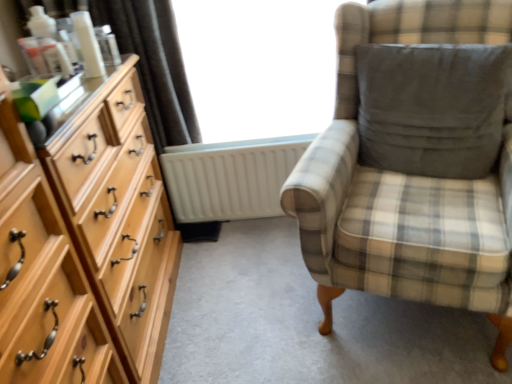
This screenshot has width=512, height=384. What do you see at coordinates (433, 108) in the screenshot?
I see `dark gray fabric pillow at right` at bounding box center [433, 108].

Identify the location of dark gray fabric pillow at right. (433, 108).

What are the coordinates of `plaid fabric chair at right` in the screenshot? It's located at (415, 161).

Describe the element at coordinates (259, 65) in the screenshot. I see `transparent glass window at center` at that location.

Identify the location of dark gray fabric pillow at right. This screenshot has width=512, height=384. (433, 108).

How different are the orientations of plaid fabric chair at right and transparent glass window at center in degrees?

They differ by 21.8 degrees in their facing directions.

Considering the relative sizes of plaid fabric chair at right and transparent glass window at center in the image provided, is plaid fabric chair at right bigger than transparent glass window at center?

Indeed, plaid fabric chair at right has a larger size compared to transparent glass window at center.

Measure the distance between plaid fabric chair at right and transparent glass window at center.

They are 26.51 inches apart.

I want to click on chair on the right of the transparent glass window at center, so click(415, 161).

Who is bigger, matte plastic bottle at upper left or transparent glass window at center?

transparent glass window at center is bigger.

You are a GUI agent. You are given a task and a screenshot of the screen. Output one action in this format:
    pyautogui.click(x=<x>, y=<y>)
    Task: Click on the toiletry in front of the transparent glass window at center
    
    Given the screenshot: What is the action you would take?
    pyautogui.click(x=45, y=46)

Based on their positions, is matte plastic bottle at upper left located to the left or right of transparent glass window at center?

Clearly, matte plastic bottle at upper left is on the left of transparent glass window at center in the image.

This screenshot has height=384, width=512. In order to click on radiator below the dark gray fabric pillow at right (from a real-world perspective) in this screenshot , I will do `click(230, 177)`.

Is dark gray fabric pillow at right outside of white matte radiator at center?

Indeed, dark gray fabric pillow at right is completely outside white matte radiator at center.

Is point (379, 67) closer to viewer compared to point (195, 176)?

Yes, point (379, 67) is in front of point (195, 176).

Is dark gray fabric pillow at right in contact with white matte radiator at center?

No.

Is dark gray fabric pillow at right oriented towards matte plastic bottle at upper left?

No, dark gray fabric pillow at right is not turned towards matte plastic bottle at upper left.

How many degrees apart are the facing directions of dark gray fabric pillow at right and matte plastic bottle at upper left?

118 degrees.

Based on the photo, from the image's perspective, is dark gray fabric pillow at right beneath matte plastic bottle at upper left?

Yes, from the image's perspective, dark gray fabric pillow at right is below matte plastic bottle at upper left.

Which of these two, dark gray fabric pillow at right or matte plastic bottle at upper left, is bigger?

With larger size is dark gray fabric pillow at right.

Consider the image. Is transparent glass window at center taller or shorter than dark gray fabric pillow at right?

In the image, transparent glass window at center appears to be taller than dark gray fabric pillow at right.

Does transparent glass window at center turn towards dark gray fabric pillow at right?

Yes, transparent glass window at center is aimed at dark gray fabric pillow at right.

Find the location of a particular element. The image size is (512, 384). pillow on the right of transparent glass window at center is located at coordinates (433, 108).

How far apart are transparent glass window at center and dark gray fabric pillow at right?

transparent glass window at center is 26.06 inches away from dark gray fabric pillow at right.

Considering the relative sizes of satin dark brown curtain at upper left and dark gray fabric pillow at right in the image provided, is satin dark brown curtain at upper left taller than dark gray fabric pillow at right?

Yes.

From a real-world perspective, is satin dark brown curtain at upper left located beneath dark gray fabric pillow at right?

No.

Would you consider satin dark brown curtain at upper left to be distant from dark gray fabric pillow at right?

Absolutely, satin dark brown curtain at upper left is distant from dark gray fabric pillow at right.

Which is in front, satin dark brown curtain at upper left or dark gray fabric pillow at right?

Positioned in front is dark gray fabric pillow at right.

In terms of height, does plaid fabric chair at right look taller or shorter compared to white matte radiator at center?

Clearly, plaid fabric chair at right is taller compared to white matte radiator at center.

Which object is further away from the camera, plaid fabric chair at right or white matte radiator at center?

Positioned behind is white matte radiator at center.

Is plaid fabric chair at right not near white matte radiator at center?

plaid fabric chair at right is near white matte radiator at center, not far away.

The image size is (512, 384). In order to click on radiator that is under the plaid fabric chair at right (from a real-world perspective) in this screenshot , I will do `click(230, 177)`.

You are a GUI agent. You are given a task and a screenshot of the screen. Output one action in this format:
    pyautogui.click(x=<x>, y=<y>)
    Task: Click on the window screen on the left side of plaid fabric chair at right
    Image resolution: width=512 pixels, height=384 pixels.
    Given the screenshot: What is the action you would take?
    pyautogui.click(x=259, y=65)

Locate an element on the screen. This screenshot has height=384, width=512. window screen on the right of matte plastic bottle at upper left is located at coordinates (259, 65).

Estimate the real-world distances between objects in this image. Which object is further from white matte radiator at center, dark gray fabric pillow at right or satin dark brown curtain at upper left?

dark gray fabric pillow at right lies further to white matte radiator at center than the other object.

Considering their positions, is dark gray fabric pillow at right positioned closer to matte plastic bottle at upper left than transparent glass window at center?

transparent glass window at center.

From the image, which object appears to be nearer to dark gray fabric pillow at right, transparent glass window at center or plaid fabric chair at right?

plaid fabric chair at right.

Based on their spatial positions, is light wood dresser at left or satin dark brown curtain at upper left closer to transparent glass window at center?

The object closer to transparent glass window at center is satin dark brown curtain at upper left.

When comparing their distances from plaid fabric chair at right, does satin dark brown curtain at upper left or matte plastic bottle at upper left seem closer?

satin dark brown curtain at upper left lies closer to plaid fabric chair at right than the other object.

Which object lies nearer to the anchor point matte plastic bottle at upper left, plaid fabric chair at right or light wood dresser at left?

light wood dresser at left is positioned closer to the anchor matte plastic bottle at upper left.

From the image, which object appears to be nearer to white matte radiator at center, light wood dresser at left or plaid fabric chair at right?

light wood dresser at left lies closer to white matte radiator at center than the other object.

Based on their spatial positions, is light wood dresser at left or satin dark brown curtain at upper left closer to white matte radiator at center?

Among the two, satin dark brown curtain at upper left is located nearer to white matte radiator at center.

At what (x,y) coordinates should I click in order to perform the action: click on curtain situated between matte plastic bottle at upper left and transparent glass window at center from left to right. Please return your answer as a coordinate pair (x, y). This screenshot has width=512, height=384. Looking at the image, I should click on (154, 63).

This screenshot has width=512, height=384. Identify the location of pillow located between light wood dresser at left and plaid fabric chair at right in the left-right direction. (433, 108).

Locate an element on the screen. The image size is (512, 384). toiletry between light wood dresser at left and satin dark brown curtain at upper left along the z-axis is located at coordinates (45, 46).

In order to click on curtain located between matte plastic bottle at upper left and white matte radiator at center in the left-right direction in this screenshot , I will do `click(154, 63)`.